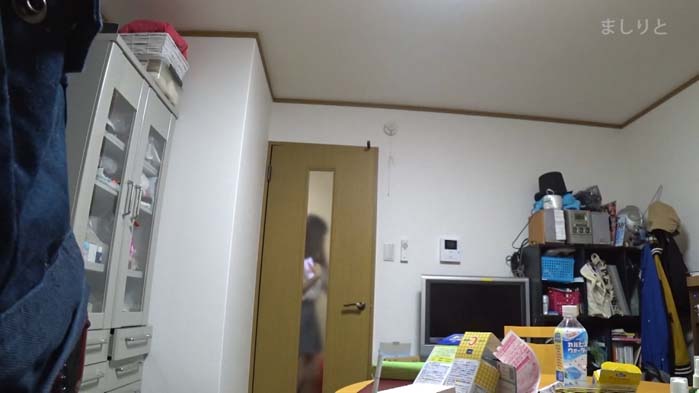
The image size is (699, 393). In order to click on drawer in this screenshot , I will do `click(138, 344)`.